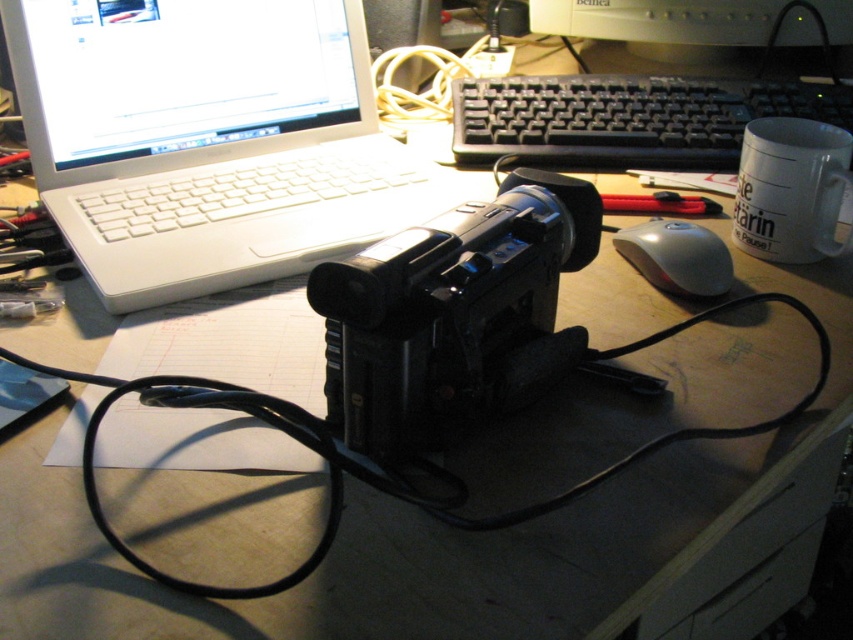
You are organizing your desk and want to place both the white plastic laptop at upper left and the white ceramic mug at upper right in a drawer. The drawer has a maximum capacity of 12 inches in length. If the laptop measures 11 inches long and the mug is 3 inches tall, will both items fit inside the drawer together?

The white plastic laptop at upper left is larger in size than the white ceramic mug at upper right. Since the laptop measures 11 inches long and the drawer has a maximum capacity of 12 inches, the laptop alone would occupy most of the space. However, the mug is only 3 inches tall, so it might fit alongside the laptop if arranged properly. However, the total length required would be approximately 14 inches, which exceeds the drawer capacity. Therefore, both items cannot fit together in the drawer.

You are standing 1 meter away from the desk and want to reach a specific point on the desk marked as point (x=177, y=17). Can you safely extend your hand to touch that point without leaning over the desk?

The distance of point (x=177, y=17) from the viewer is 78.51 centimeters. Since you are standing 1 meter away, which is 100 centimeters, you can safely extend your hand to touch the point without leaning over the desk as it is within reach.

In the scene shown: You are organizing the cables on your desk and notice two points marked on the desk surface. The first point is labeled as point (848,104), and the second point is labeled as point (762,180). Which point is closer to you when looking at the desk from the front?

Point (762,180) is closer to you because it is in front of point (848,104).